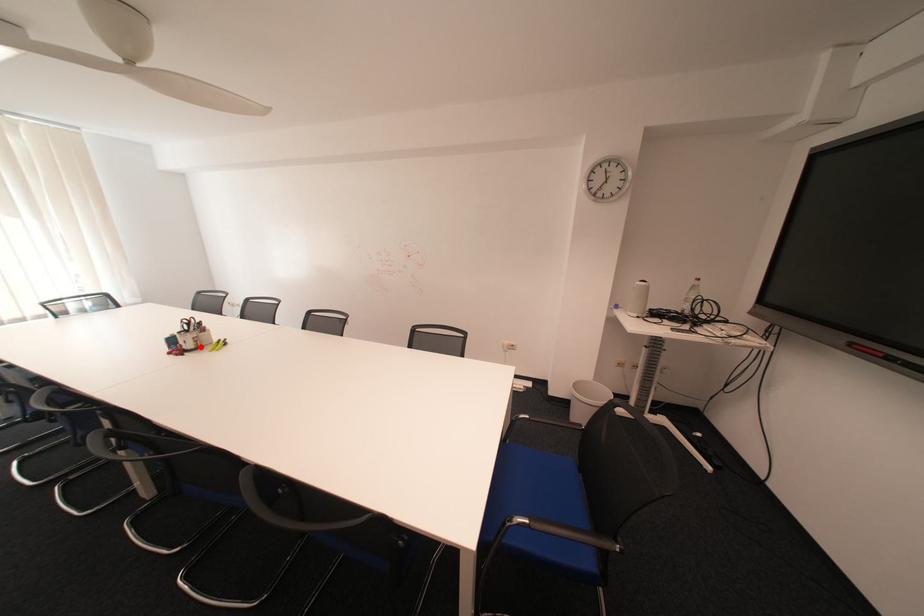
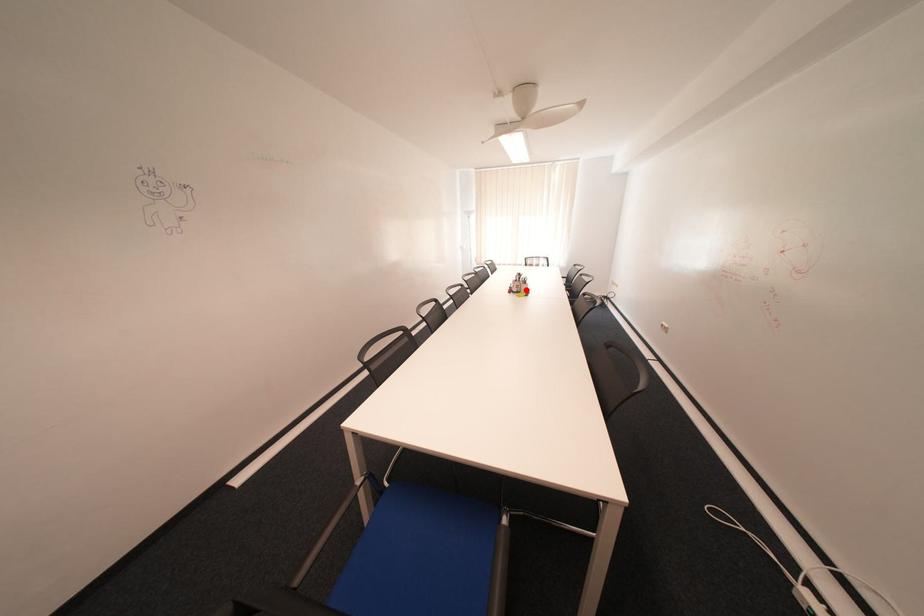
I am providing you with two images of the same scene from different viewpoints. A red point is marked on the first image and another point is marked on the second image. Does the point marked in image1 correspond to the same location as the one in image2?

Yes